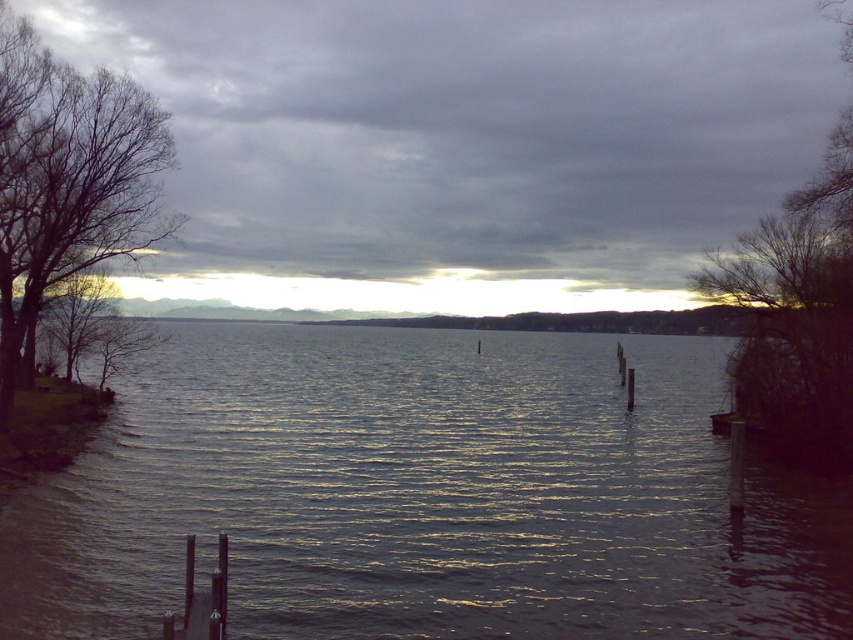
Question: Among these objects, which one is nearest to the camera?

Choices:
 (A) bare branches at right
 (B) bare branches at left
 (C) smooth wood dock at lower left

Answer: (C)

Question: Does gray cloudy sky at upper center appear on the left side of smooth wood dock at lower left?

Choices:
 (A) yes
 (B) no

Answer: (A)

Question: Is shiny blue water at center bigger than bare branches at left?

Choices:
 (A) no
 (B) yes

Answer: (B)

Question: Which object is closer to the camera taking this photo?

Choices:
 (A) gray cloudy sky at upper center
 (B) bare branches at right

Answer: (A)

Question: Which of these objects is positioned closest to the gray cloudy sky at upper center?

Choices:
 (A) shiny blue water at center
 (B) smooth wood dock at lower left

Answer: (A)

Question: Is shiny blue water at center positioned behind bare branches at left?

Choices:
 (A) yes
 (B) no

Answer: (B)